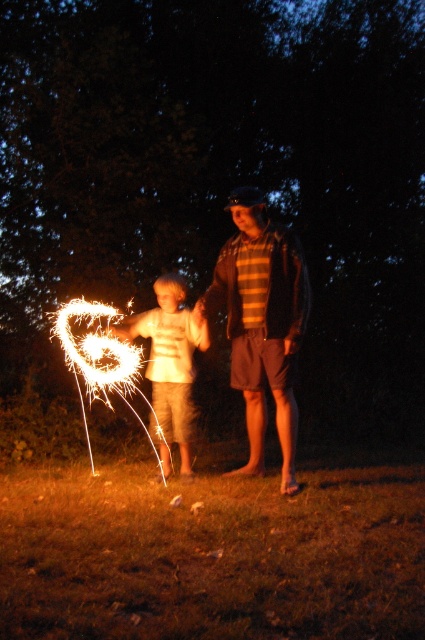
Question: Is striped cotton shirt at center smaller than white cotton shirt at center?

Choices:
 (A) yes
 (B) no

Answer: (B)

Question: Which object appears closest to the camera in this image?

Choices:
 (A) white cotton shirt at center
 (B) striped cotton shirt at center

Answer: (B)

Question: Is striped cotton shirt at center to the left of white cotton shirt at center from the viewer's perspective?

Choices:
 (A) no
 (B) yes

Answer: (A)

Question: Which point is farther from the camera taking this photo?

Choices:
 (A) (169, 314)
 (B) (244, 225)

Answer: (A)

Question: Is striped cotton shirt at center wider than white cotton shirt at center?

Choices:
 (A) yes
 (B) no

Answer: (A)